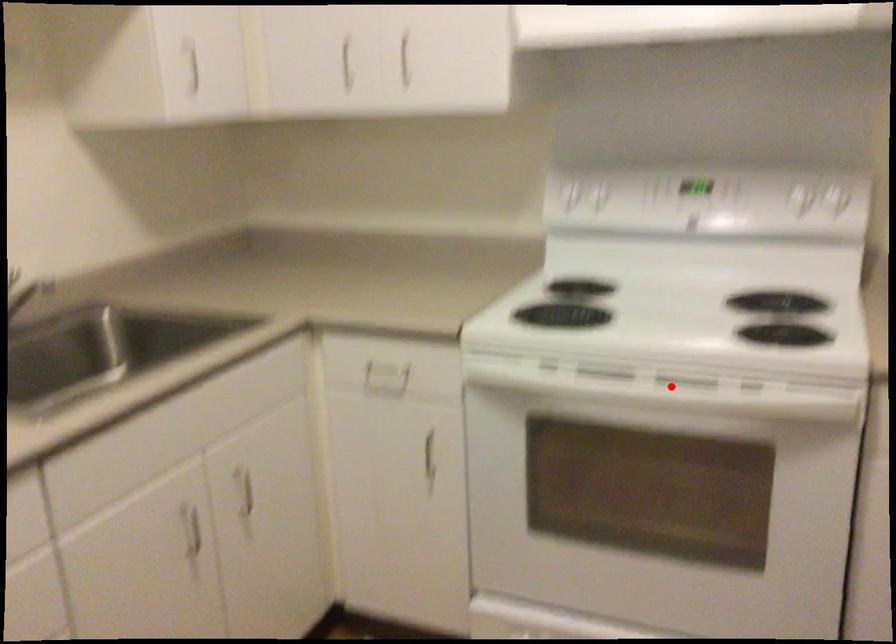
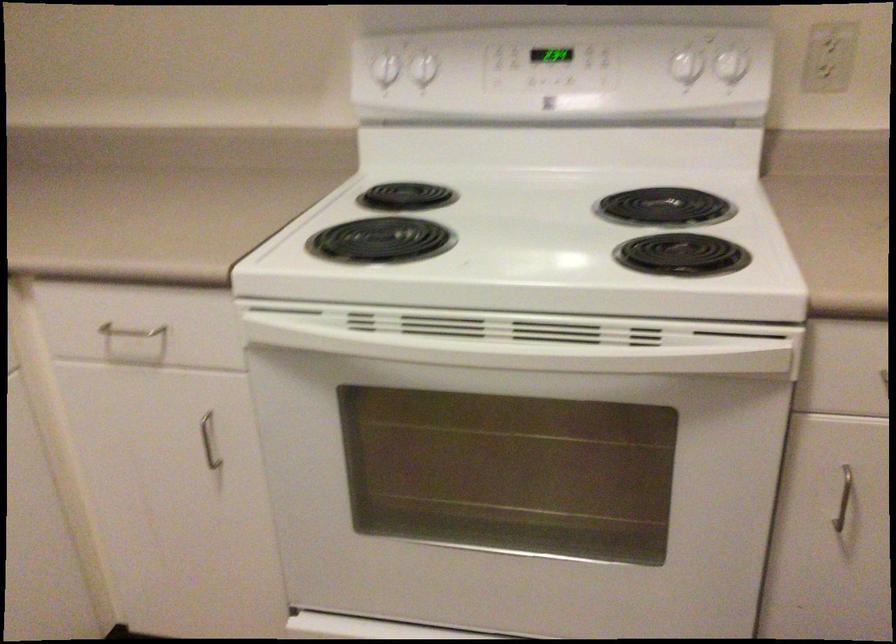
Question: I am providing you with two images of the same scene from different viewpoints. Given a red point in image1, look at the same physical point in image2. Is it:

Choices:
 (A) Closer to the viewpoint
 (B) Farther from the viewpoint

Answer: (A)